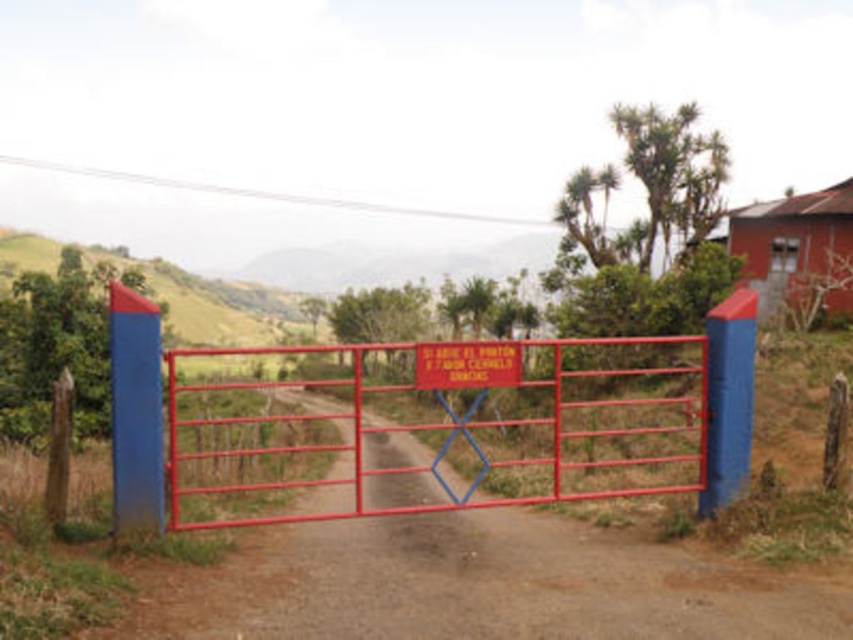
Question: Based on their relative distances, which object is nearer to the red plastic sign at center?

Choices:
 (A) metal gate at center
 (B) dirt track at center

Answer: (B)

Question: Estimate the real-world distances between objects in this image. Which object is closer to the metal gate at center?

Choices:
 (A) red plastic sign at center
 (B) dirt track at center

Answer: (B)

Question: Is dirt track at center smaller than metal gate at center?

Choices:
 (A) no
 (B) yes

Answer: (B)

Question: Among these points, which one is farthest from the camera?

Choices:
 (A) (444, 358)
 (B) (547, 465)
 (C) (537, 634)

Answer: (B)

Question: Observing the image, what is the correct spatial positioning of dirt track at center in reference to metal gate at center?

Choices:
 (A) right
 (B) left

Answer: (A)

Question: Can you confirm if dirt track at center is positioned to the right of metal gate at center?

Choices:
 (A) no
 (B) yes

Answer: (B)